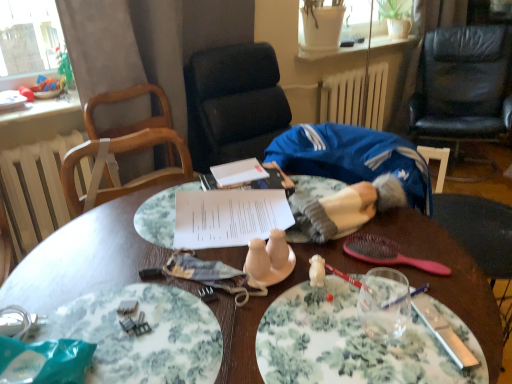
This screenshot has height=384, width=512. In order to click on vacant space to the right of white ceramic salt and pepper shakers at center in this screenshot , I will do `click(339, 285)`.